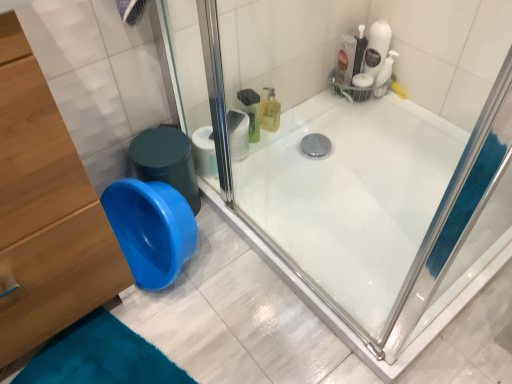
Locate an element on the screen. free space to the right of wooden dresser at left is located at coordinates (181, 314).